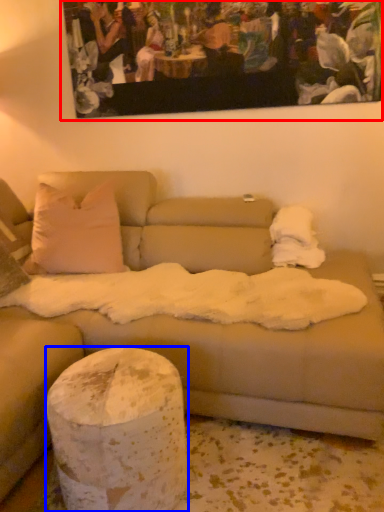
Question: Which point is closer to the camera, picture frame (highlighted by a red box) or pillar (highlighted by a blue box)?

Choices:
 (A) picture frame
 (B) pillar

Answer: (B)